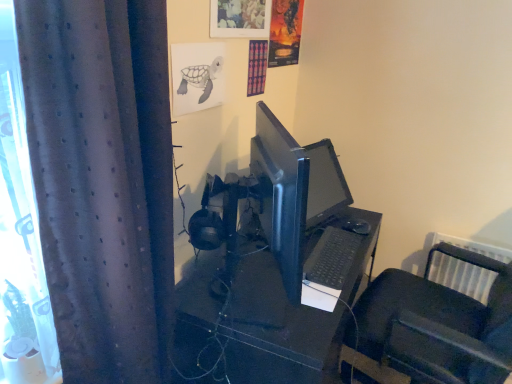
Identify the location of empty space that is ontop of black matte keyboard at center (from a real-world perspective). (328, 244).